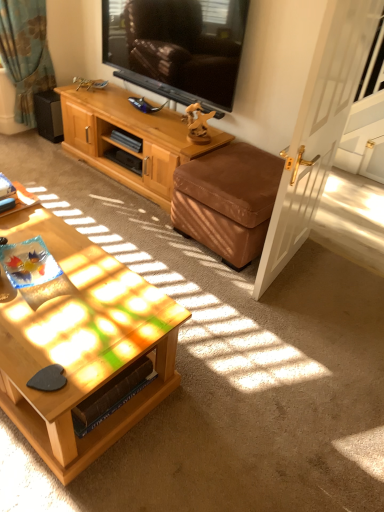
At what (x,y) coordinates should I click in order to perform the action: click on vacant region in front of teal fabric curtain at upper left. Please return your answer as a coordinate pair (x, y). The height and width of the screenshot is (512, 384). Looking at the image, I should click on (32, 149).